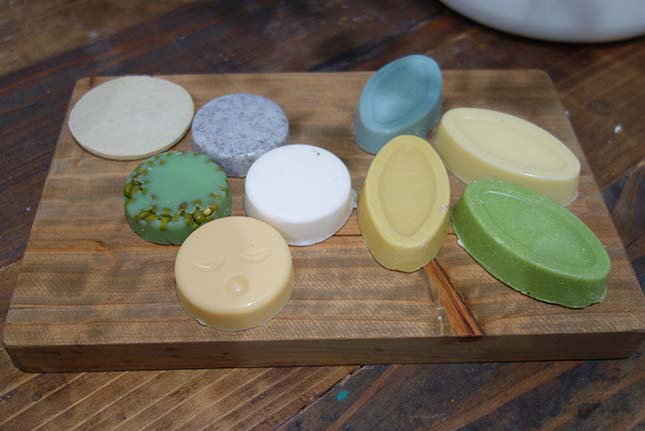
Image resolution: width=645 pixels, height=431 pixels. Find the location of `wooden table top`. wooden table top is located at coordinates [x=595, y=81].